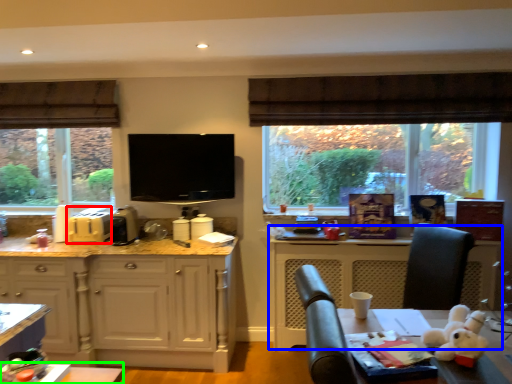
Question: Based on their relative distances, which object is farther from appliance (highlighted by a red box)? Choose from counter (highlighted by a blue box) and table (highlighted by a green box).

Choices:
 (A) counter
 (B) table

Answer: (A)